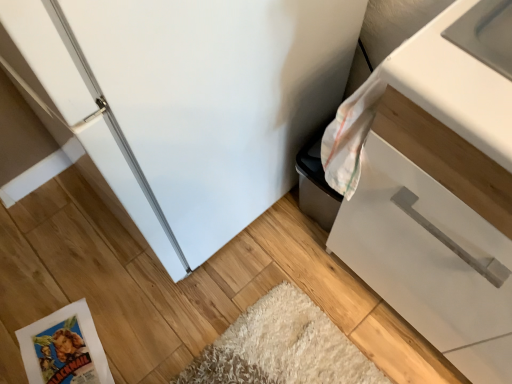
This screenshot has width=512, height=384. What do you see at coordinates (437, 189) in the screenshot?
I see `white matte cabinet at right` at bounding box center [437, 189].

Find the location of a particular element. white matte cabinet at right is located at coordinates (437, 189).

At what (x,y) coordinates should I click in order to perform the action: click on white paper comic book at lower left. Please return your answer as a coordinate pair (x, y). This screenshot has height=384, width=512. Looking at the image, I should click on (64, 348).

The width and height of the screenshot is (512, 384). What do you see at coordinates (64, 348) in the screenshot?
I see `white paper comic book at lower left` at bounding box center [64, 348].

Where is `white matte cabinet at right`? white matte cabinet at right is located at coordinates (437, 189).

Considering the relative positions of white matte cabinet at right and white paper comic book at lower left in the image provided, is white matte cabinet at right to the right of white paper comic book at lower left from the viewer's perspective?

Yes, white matte cabinet at right is to the right of white paper comic book at lower left.

Which object is further away from the camera, white matte cabinet at right or white paper comic book at lower left?

white paper comic book at lower left is behind.

Considering the positions of points (408, 43) and (52, 324), is point (408, 43) farther from camera compared to point (52, 324)?

No.

From the picture: From the image's perspective, between white matte cabinet at right and white paper comic book at lower left, which one is located above?

white matte cabinet at right appears higher in the image.

From a real-world perspective, is white matte cabinet at right physically located above or below white paper comic book at lower left?

Clearly, from a real-world perspective, white matte cabinet at right is above white paper comic book at lower left.

Can you confirm if white matte cabinet at right is wider than white paper comic book at lower left?

Yes, white matte cabinet at right is wider than white paper comic book at lower left.

Is white matte cabinet at right taller than white paper comic book at lower left?

Yes.

Considering the sizes of white matte cabinet at right and white paper comic book at lower left in the image, is white matte cabinet at right bigger or smaller than white paper comic book at lower left?

In the image, white matte cabinet at right appears to be larger than white paper comic book at lower left.

Is white matte cabinet at right inside the boundaries of white paper comic book at lower left, or outside?

white matte cabinet at right exists outside the volume of white paper comic book at lower left.

Would you consider white matte cabinet at right to be distant from white paper comic book at lower left?

No, there isn't a large distance between white matte cabinet at right and white paper comic book at lower left.

Is white matte cabinet at right turned away from white paper comic book at lower left?

No, white matte cabinet at right is not facing away from white paper comic book at lower left.

How many degrees apart are the facing directions of white matte cabinet at right and white paper comic book at lower left?

178 degrees.

Identify the location of cabinetry that appears above the white paper comic book at lower left (from a real-world perspective). The width and height of the screenshot is (512, 384). (437, 189).

Is white paper comic book at lower left at the left side of white matte cabinet at right?

Yes, white paper comic book at lower left is to the left of white matte cabinet at right.

Between white paper comic book at lower left and white matte cabinet at right, which one is positioned behind?

white paper comic book at lower left is further from the camera.

Between point (37, 368) and point (327, 135), which one is positioned in front?

The point (327, 135) is closer to the camera.

From the image's perspective, is white paper comic book at lower left on white matte cabinet at right?

No, from the image's perspective, white paper comic book at lower left is not above white matte cabinet at right.

From a real-world perspective, which is physically below, white paper comic book at lower left or white matte cabinet at right?

white paper comic book at lower left is physically lower.

Can you confirm if white paper comic book at lower left is thinner than white matte cabinet at right?

Yes.

Considering the relative sizes of white paper comic book at lower left and white matte cabinet at right in the image provided, is white paper comic book at lower left taller than white matte cabinet at right?

No, white paper comic book at lower left is not taller than white matte cabinet at right.

Considering the relative sizes of white paper comic book at lower left and white matte cabinet at right in the image provided, is white paper comic book at lower left bigger than white matte cabinet at right?

No.

Consider the image. Is white paper comic book at lower left completely or partially outside of white matte cabinet at right?

Yes.

Is white paper comic book at lower left with white matte cabinet at right?

No, white paper comic book at lower left is not with white matte cabinet at right.

Is white paper comic book at lower left looking in the opposite direction of white matte cabinet at right?

No.

How many degrees apart are the facing directions of white paper comic book at lower left and white matte cabinet at right?

The angle between the facing direction of white paper comic book at lower left and the facing direction of white matte cabinet at right is 178 degrees.

Measure the distance between white paper comic book at lower left and white matte cabinet at right.

They are 90.18 centimeters apart.

In order to click on comic book to the left of white matte cabinet at right in this screenshot , I will do `click(64, 348)`.

The width and height of the screenshot is (512, 384). I want to click on cabinetry that appears above the white paper comic book at lower left (from the image's perspective), so (437, 189).

The height and width of the screenshot is (384, 512). What are the coordinates of `cabinetry located in front of the white paper comic book at lower left` in the screenshot? It's located at [x=437, y=189].